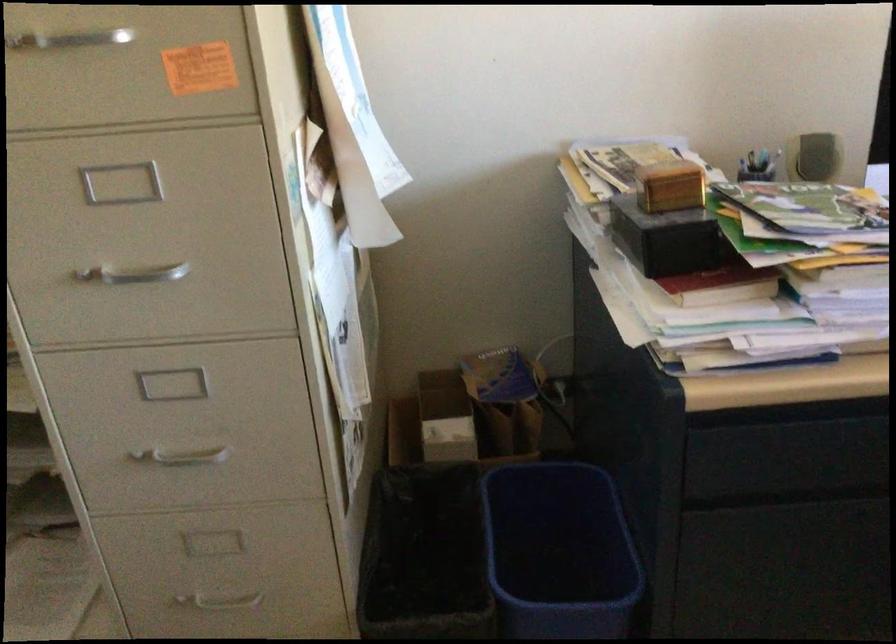
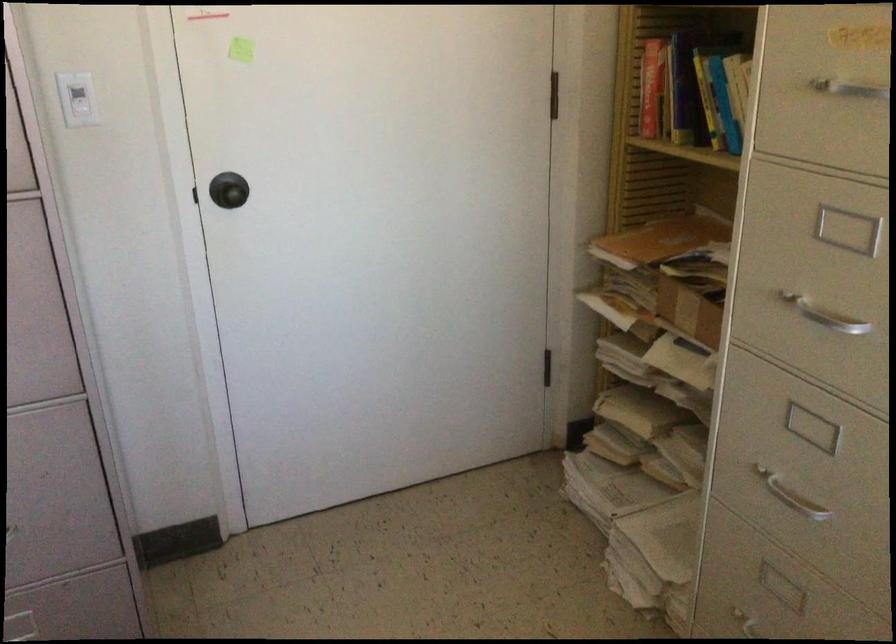
In the second image, find the point that corresponds to (x=190, y=450) in the first image.

(790, 496)